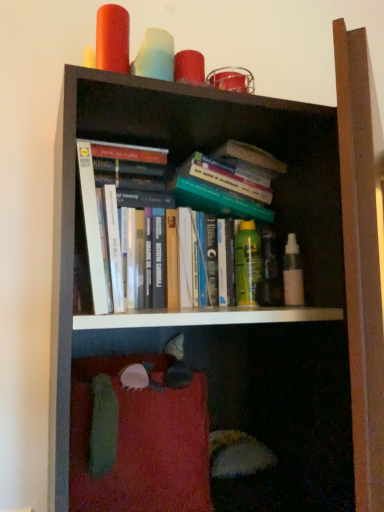
Question: Is the position of white paperbacks at center more distant than that of white matte spray bottle at center right, marked as the second toiletry in a back-to-front arrangement?

Choices:
 (A) yes
 (B) no

Answer: (B)

Question: Is white paperbacks at center to the right of white matte spray bottle at center right, acting as the 1th toiletry starting from the right, from the viewer's perspective?

Choices:
 (A) no
 (B) yes

Answer: (A)

Question: Can you confirm if white paperbacks at center is bigger than white matte spray bottle at center right, arranged as the 2th toiletry when viewed from the left?

Choices:
 (A) no
 (B) yes

Answer: (B)

Question: Considering the relative sizes of white paperbacks at center and white matte spray bottle at center right, arranged as the 2th toiletry when viewed from the left, in the image provided, is white paperbacks at center smaller than white matte spray bottle at center right, arranged as the 2th toiletry when viewed from the left,?

Choices:
 (A) no
 (B) yes

Answer: (A)

Question: Can you confirm if white paperbacks at center is thinner than white matte spray bottle at center right, marked as the second toiletry in a back-to-front arrangement?

Choices:
 (A) yes
 (B) no

Answer: (B)

Question: From the image's perspective, is white paperbacks at center on top of white matte spray bottle at center right, arranged as the 2th toiletry when viewed from the left?

Choices:
 (A) yes
 (B) no

Answer: (A)

Question: Can you confirm if green matte spray can at center, arranged as the first toiletry when viewed from the back, is smaller than white paperbacks at center?

Choices:
 (A) no
 (B) yes

Answer: (B)

Question: Considering the relative positions of green matte spray can at center, arranged as the second toiletry when viewed from the front, and white paperbacks at center in the image provided, is green matte spray can at center, arranged as the second toiletry when viewed from the front, in front of white paperbacks at center?

Choices:
 (A) no
 (B) yes

Answer: (A)

Question: From the image's perspective, is green matte spray can at center, arranged as the second toiletry when viewed from the front, over white paperbacks at center?

Choices:
 (A) no
 (B) yes

Answer: (A)

Question: Can you confirm if green matte spray can at center, which is the first toiletry in left-to-right order, is wider than white paperbacks at center?

Choices:
 (A) yes
 (B) no

Answer: (B)

Question: Does green matte spray can at center, the 2th toiletry positioned from the right, appear on the right side of white paperbacks at center?

Choices:
 (A) yes
 (B) no

Answer: (A)

Question: Are green matte spray can at center, arranged as the first toiletry when viewed from the back, and white paperbacks at center beside each other?

Choices:
 (A) no
 (B) yes

Answer: (A)

Question: Is white matte spray bottle at center right, marked as the second toiletry in a back-to-front arrangement, outside of white paperbacks at center?

Choices:
 (A) yes
 (B) no

Answer: (A)